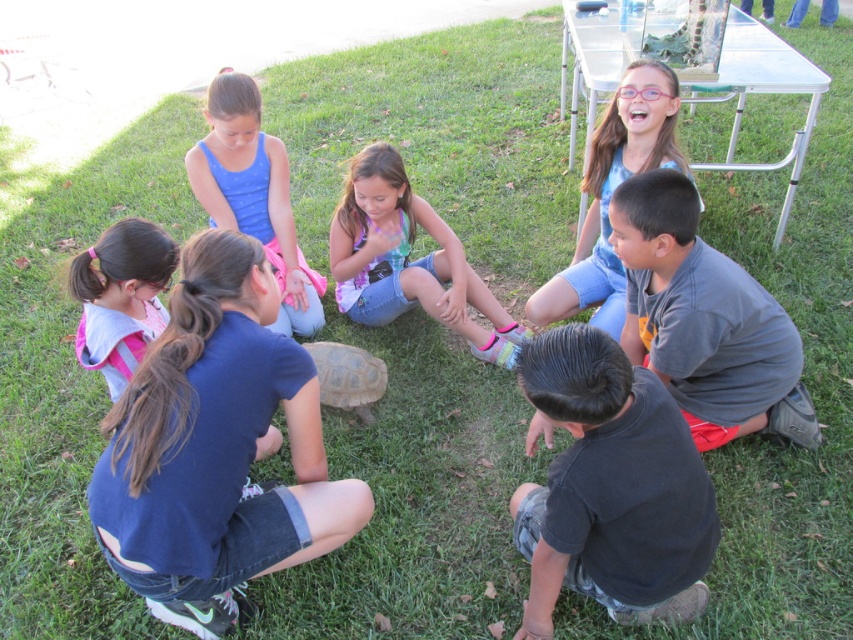
Between denim shorts at lower left and black cotton shirt at lower right, which one has less height?

Standing shorter between the two is black cotton shirt at lower right.

Measure the distance between denim shorts at lower left and black cotton shirt at lower right.

They are 33.56 inches apart.

Which is behind, point (114, 404) or point (612, 387)?

Positioned behind is point (114, 404).

I want to click on denim shorts at lower left, so click(216, 448).

Who is positioned more to the right, pink denim shorts at center or brown rough textured turtle at center?

pink denim shorts at center

Which is above, pink denim shorts at center or brown rough textured turtle at center?

pink denim shorts at center is higher up.

Is point (436, 240) more distant than point (379, 372)?

Yes, it is behind point (379, 372).

Identify the location of pink denim shorts at center. This screenshot has width=853, height=640. (407, 259).

Between black cotton shirt at lower right and pink fabric backpack at lower left, which one is positioned lower?

black cotton shirt at lower right is below.

From the picture: Measure the distance between black cotton shirt at lower right and pink fabric backpack at lower left.

They are 1.62 meters apart.

You are a GUI agent. You are given a task and a screenshot of the screen. Output one action in this format:
    pyautogui.click(x=<x>, y=<y>)
    Task: Click on the black cotton shirt at lower right
    The image size is (853, 640).
    Given the screenshot: What is the action you would take?
    pyautogui.click(x=612, y=484)